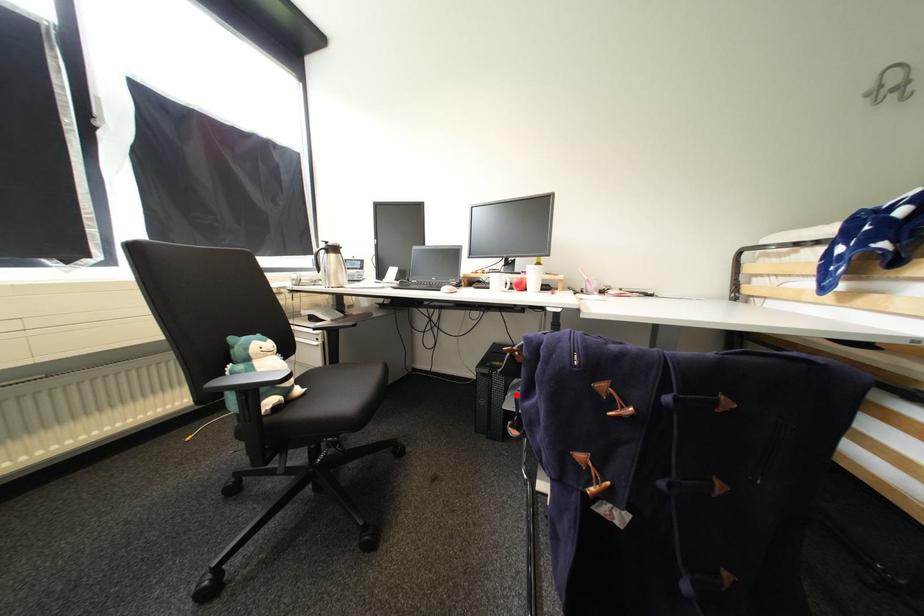
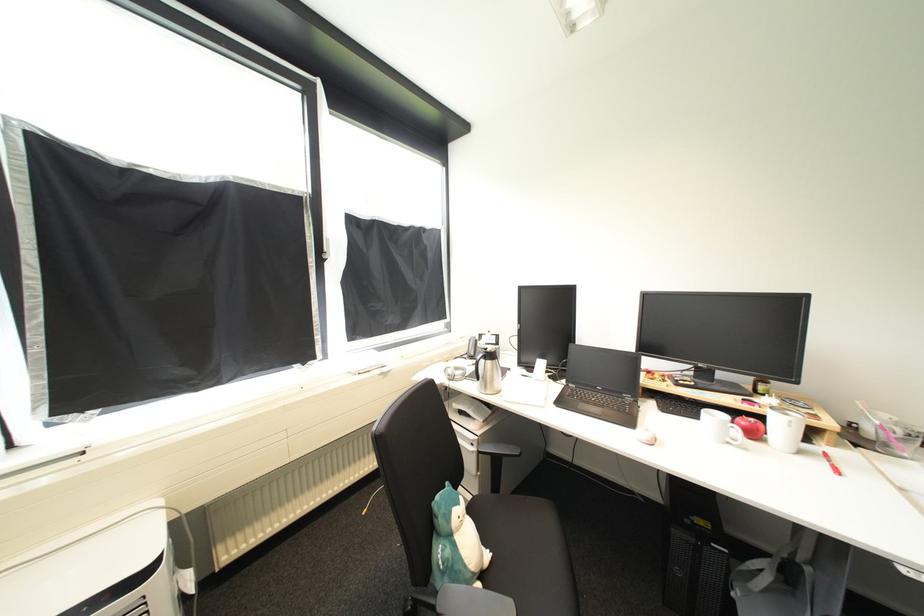
In the second image, find the point that corresponds to the highlighted location in the first image.

(745, 591)